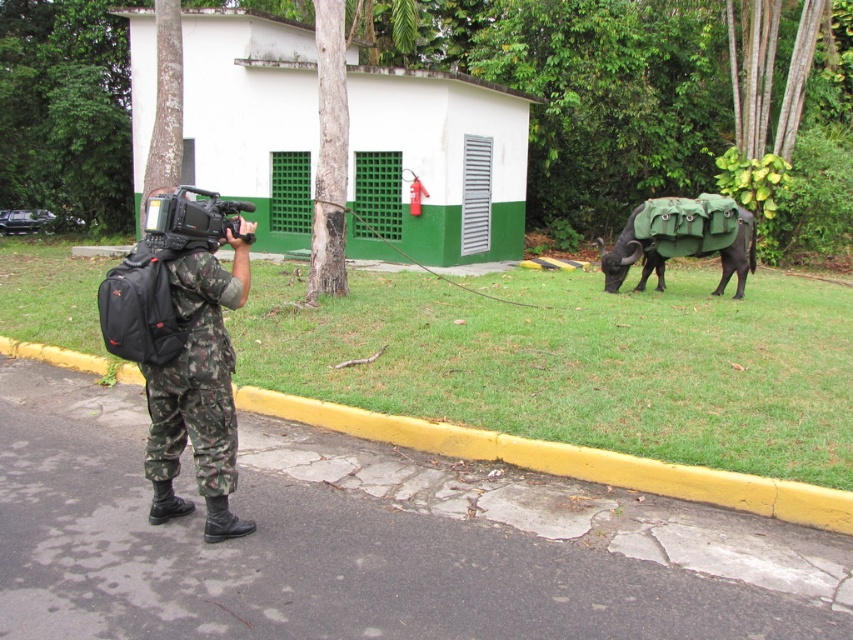
Does camouflage fabric uniform at left appear on the right side of black matte video camera at left?

Yes, camouflage fabric uniform at left is to the right of black matte video camera at left.

Does point (178, 509) come farther from viewer compared to point (200, 204)?

Yes, point (178, 509) is farther from viewer.

Which is in front, point (215, 484) or point (209, 241)?

Point (215, 484)

Where is `camouflage fabric uniform at left`? camouflage fabric uniform at left is located at coordinates (198, 388).

Does camouflage fabric uniform at left have a greater height compared to green fabric-covered animal at right?

Yes.

Who is positioned more to the left, camouflage fabric uniform at left or green fabric-covered animal at right?

camouflage fabric uniform at left

Is point (199, 476) farther from camera compared to point (657, 243)?

No, (199, 476) is closer to viewer.

At what (x,y) coordinates should I click in order to perform the action: click on camouflage fabric uniform at left. Please return your answer as a coordinate pair (x, y). The height and width of the screenshot is (640, 853). Looking at the image, I should click on (198, 388).

From the picture: Can you confirm if green fabric-covered animal at right is thinner than black matte video camera at left?

Yes, green fabric-covered animal at right is thinner than black matte video camera at left.

Which is behind, point (691, 200) or point (167, 232)?

Point (691, 200)

Locate an element on the screen. Image resolution: width=853 pixels, height=640 pixels. green fabric-covered animal at right is located at coordinates (682, 240).